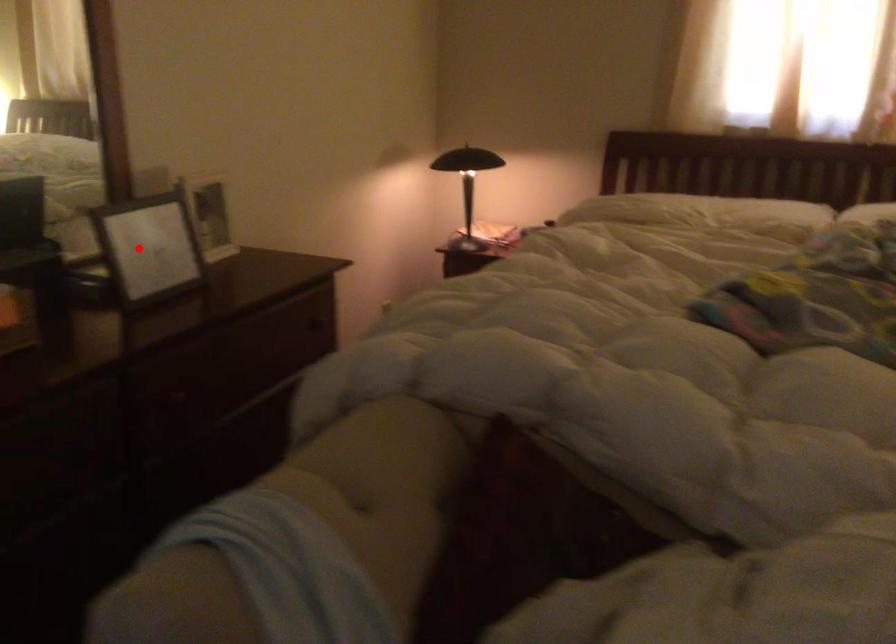
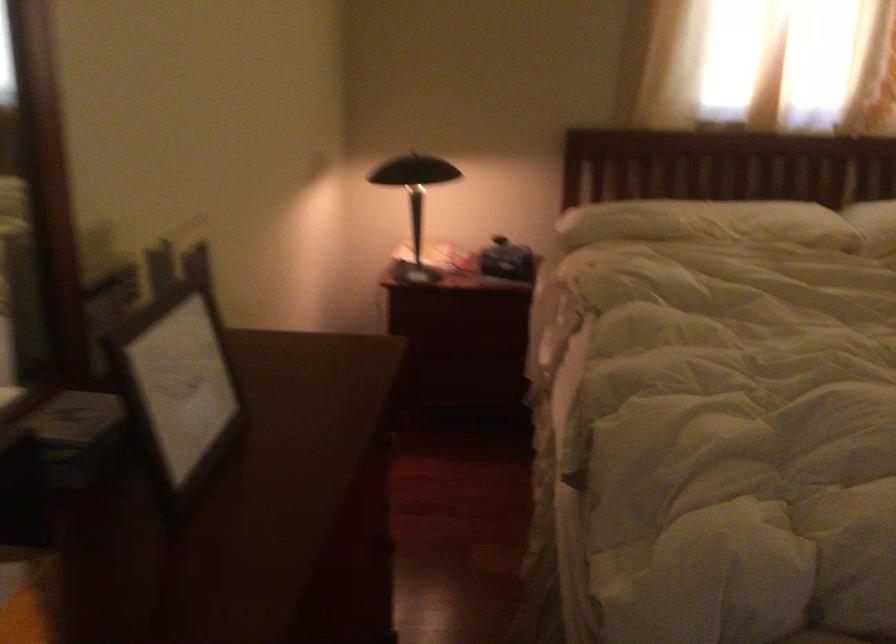
In the second image, find the point that corresponds to the highlighted location in the first image.

(177, 386)